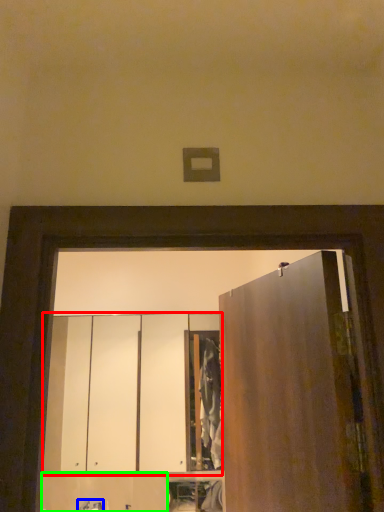
Question: Based on their relative distances, which object is farther from cabinetry (highlighted by a red box)? Choose from faucet (highlighted by a blue box) and cabinetry (highlighted by a green box).

Choices:
 (A) faucet
 (B) cabinetry

Answer: (A)